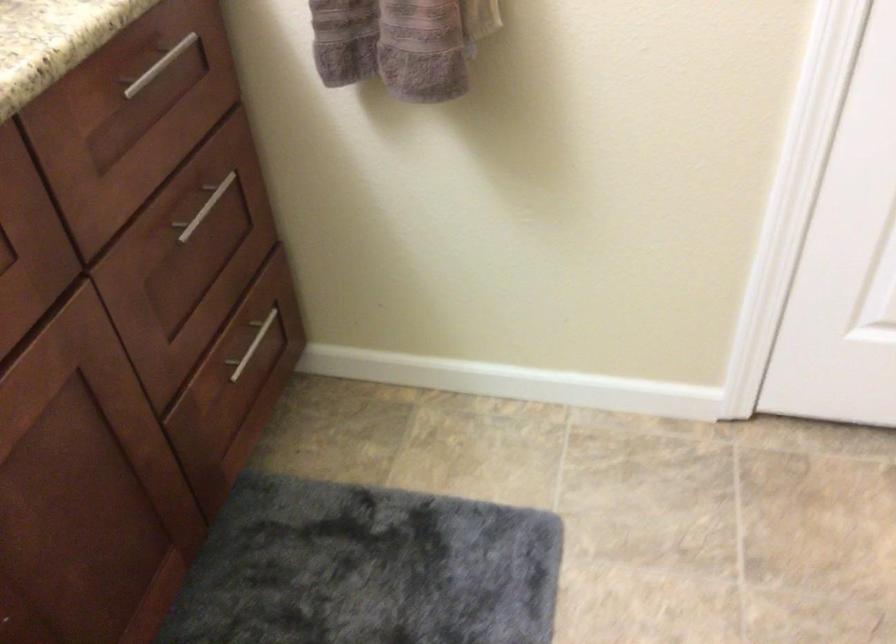
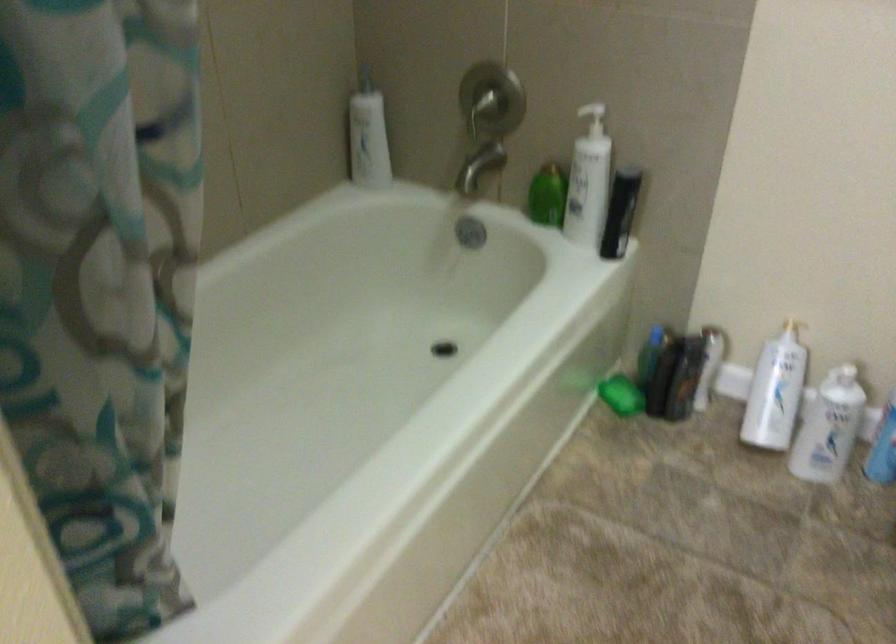
Question: The camera is either moving clockwise (left) or counter-clockwise (right) around the object. The first image is from the beginning of the video and the second image is from the end. Is the camera moving left or right when shooting the video?

Choices:
 (A) Left
 (B) Right

Answer: (A)